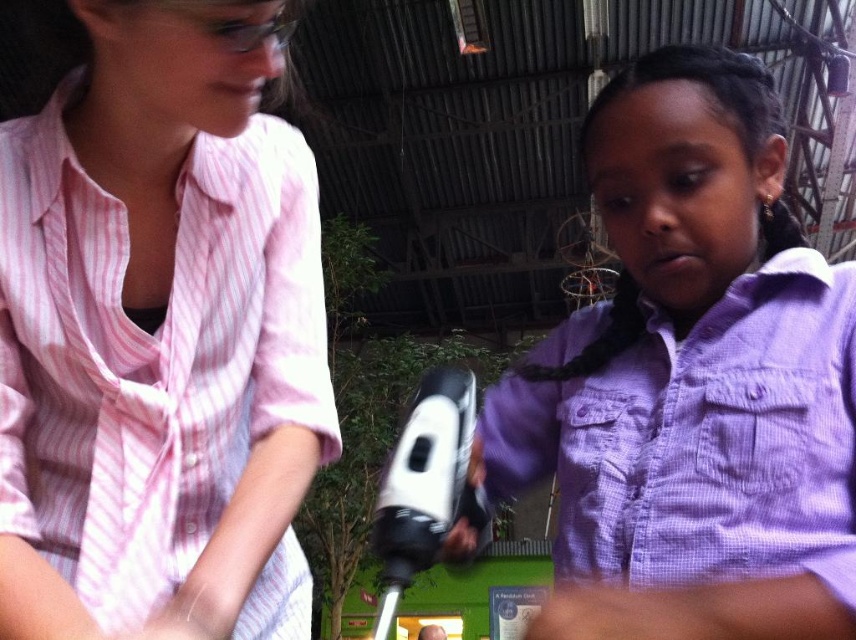
Does pink striped shirt at upper left have a greater height compared to purple checkered shirt at center?

Correct, pink striped shirt at upper left is much taller as purple checkered shirt at center.

Does pink striped shirt at upper left have a smaller size compared to purple checkered shirt at center?

Indeed, pink striped shirt at upper left has a smaller size compared to purple checkered shirt at center.

Which is in front, point (51, 289) or point (557, 518)?

Positioned in front is point (51, 289).

Where is `pink striped shirt at upper left`? The height and width of the screenshot is (640, 856). pink striped shirt at upper left is located at coordinates (159, 336).

Does purple checkered shirt at center have a greater height compared to purple silky hair at center?

Yes.

Between point (690, 102) and point (788, 218), which one is positioned behind?

The point (788, 218) is behind.

At what (x,y) coordinates should I click in order to perform the action: click on purple checkered shirt at center. Please return your answer as a coordinate pair (x, y). Image resolution: width=856 pixels, height=640 pixels. Looking at the image, I should click on (691, 381).

Between pink striped shirt at upper left and purple silky hair at center, which one has more height?

Standing taller between the two is pink striped shirt at upper left.

Is pink striped shirt at upper left to the right of purple silky hair at center from the viewer's perspective?

In fact, pink striped shirt at upper left is to the left of purple silky hair at center.

Is point (146, 205) positioned before point (666, 61)?

Yes, point (146, 205) is closer to viewer.

Find the location of a particular element. pink striped shirt at upper left is located at coordinates (159, 336).